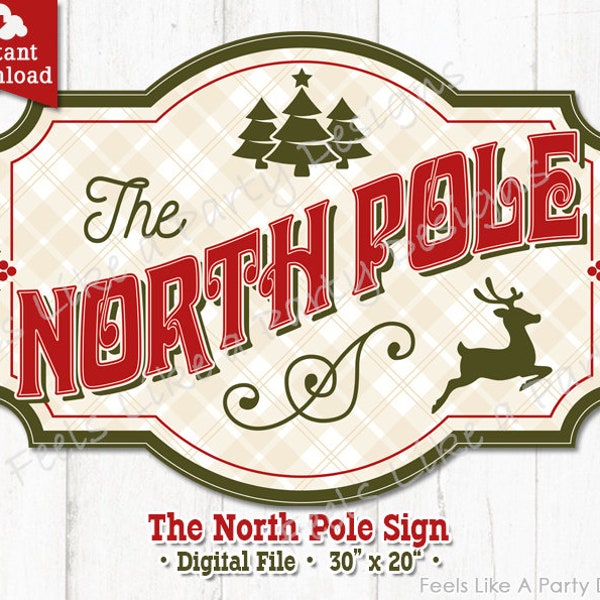
The width and height of the screenshot is (600, 600). I want to click on christmas trees, so click(x=301, y=129), click(x=260, y=128), click(x=346, y=131).